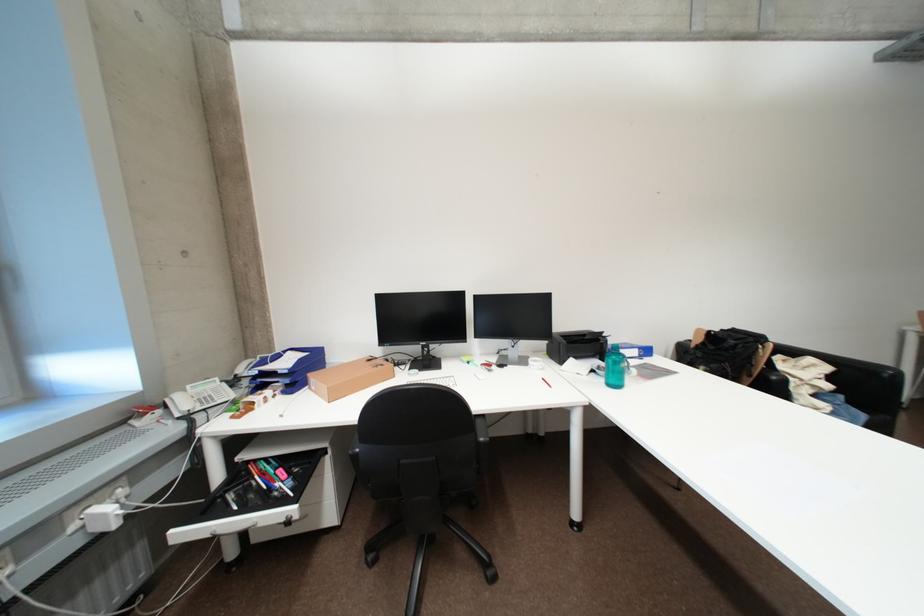
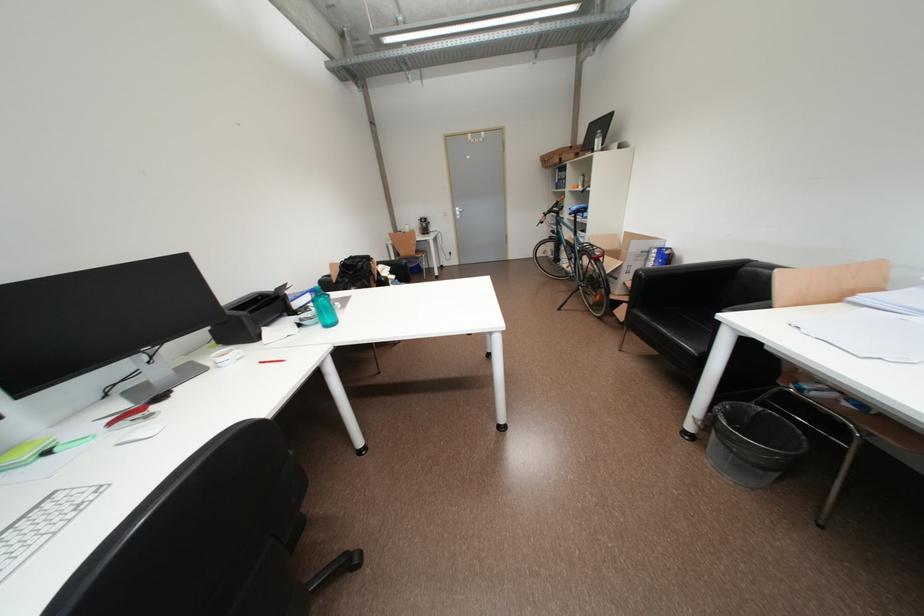
Based on the continuous images, in which direction is the camera rotating?

The rotation direction of the camera is right-down.